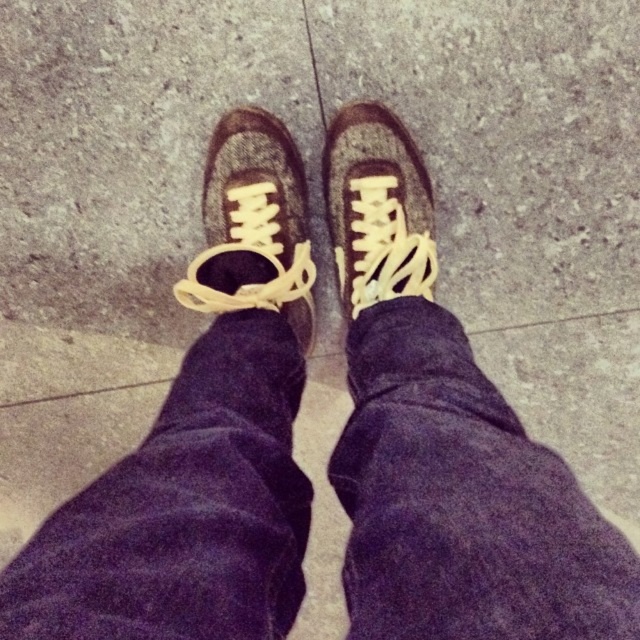
Does leather shoe at center have a greater width compared to matte brown shoe at center?

Yes.

In order to click on leather shoe at center in this screenshot , I will do `click(253, 225)`.

Who is more forward, (248,305) or (326,132)?

Point (248,305) is in front.

I want to click on leather shoe at center, so click(253, 225).